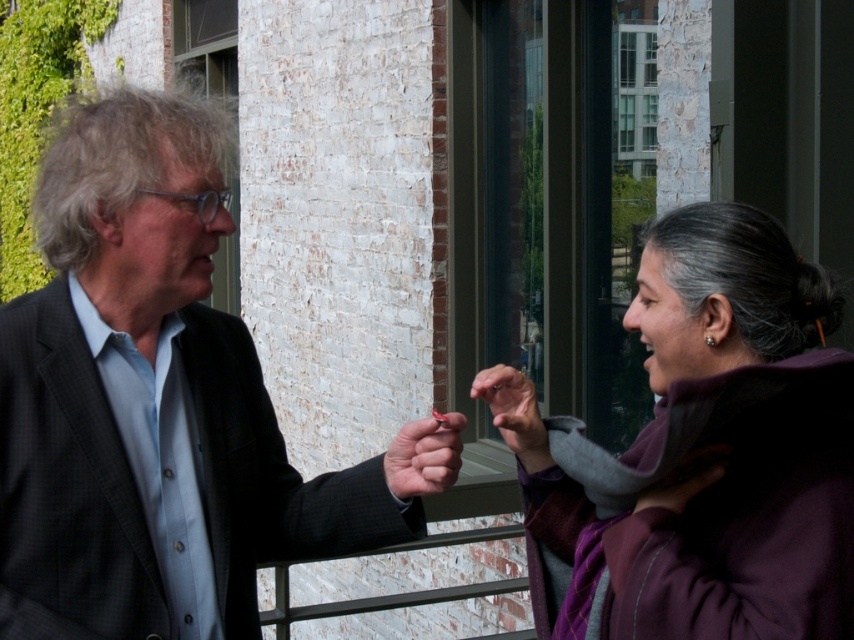
You are a tailor measuring the distance between the matte black suit at left and the matte black hand at center for alterations. Can you fit a 16 inch long ruler between them?

The distance between the matte black suit at left and the matte black hand at center is 18.05 inches. Since the ruler is 16 inches long, it can fit within the space between them.

You are an interior designer observing the scene. You need to determine the spatial relationship between the matte black suit at left and the matte black hand at center. Which object is closer to the viewer?

The matte black suit at left is closer to the viewer than the matte black hand at center because it is positioned in front of it.

You are a photographer trying to capture a closeup shot of the hands in the image. The matte black hand at center and the matte gray hand at center are overlapping. Which hand should you focus on to ensure the other hand is in the background?

The matte black hand at center is located below the matte gray hand at center, so focusing on the matte gray hand at center will place the matte black hand at center in the background.